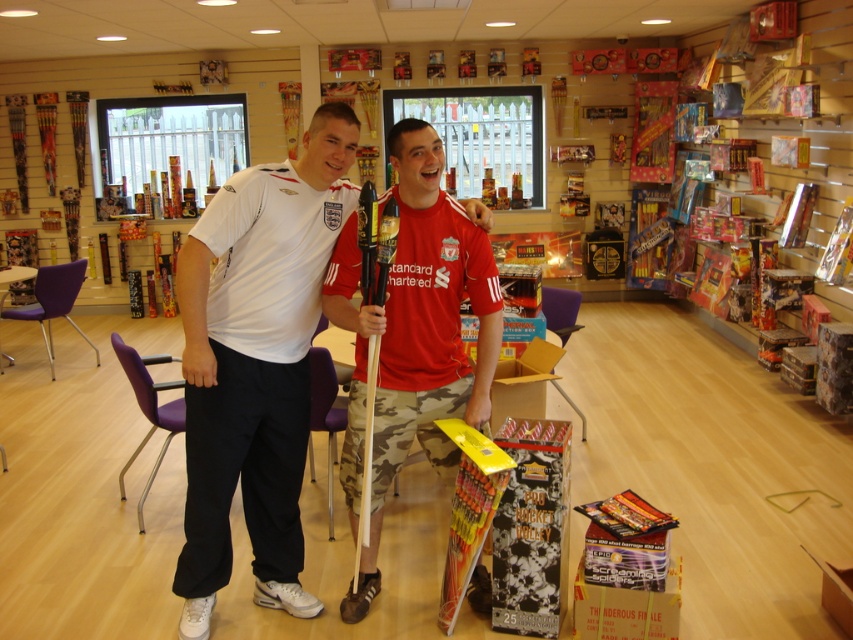
Question: Which point is closer to the camera taking this photo?

Choices:
 (A) (248, 340)
 (B) (415, 332)

Answer: (A)

Question: Is white matte t-shirt at center bigger than camouflage shorts at center?

Choices:
 (A) no
 (B) yes

Answer: (B)

Question: Is white matte t-shirt at center positioned behind camouflage shorts at center?

Choices:
 (A) yes
 (B) no

Answer: (A)

Question: Which of the following is the farthest from the observer?

Choices:
 (A) (310, 612)
 (B) (418, 417)

Answer: (A)

Question: Does white matte t-shirt at center appear under camouflage shorts at center?

Choices:
 (A) yes
 (B) no

Answer: (B)